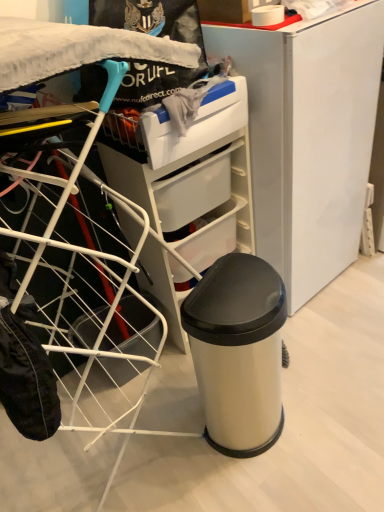
Question: In the image, is satin white laundry basket at left positioned in front of or behind satin silver trash can at center?

Choices:
 (A) behind
 (B) front

Answer: (B)

Question: From a real-world perspective, relative to satin silver trash can at center, is satin white laundry basket at left vertically above or below?

Choices:
 (A) above
 (B) below

Answer: (A)

Question: Considering the real-world distances, which object is farthest from the satin silver trash can at center?

Choices:
 (A) satin white laundry basket at left
 (B) satin white fridge at center

Answer: (B)

Question: Estimate the real-world distances between objects in this image. Which object is farther from the satin silver trash can at center?

Choices:
 (A) satin white laundry basket at left
 (B) satin white fridge at center

Answer: (B)